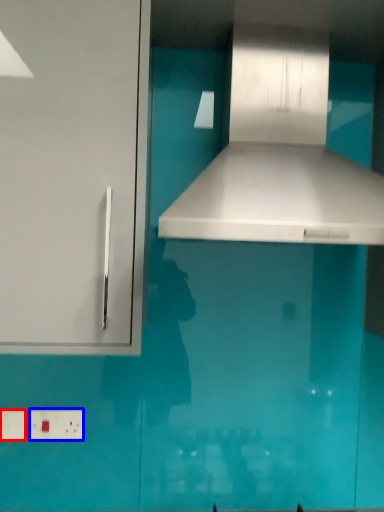
Question: Which of the following is the closest to the observer, electric outlet (highlighted by a red box) or electric outlet (highlighted by a blue box)?

Choices:
 (A) electric outlet
 (B) electric outlet

Answer: (A)